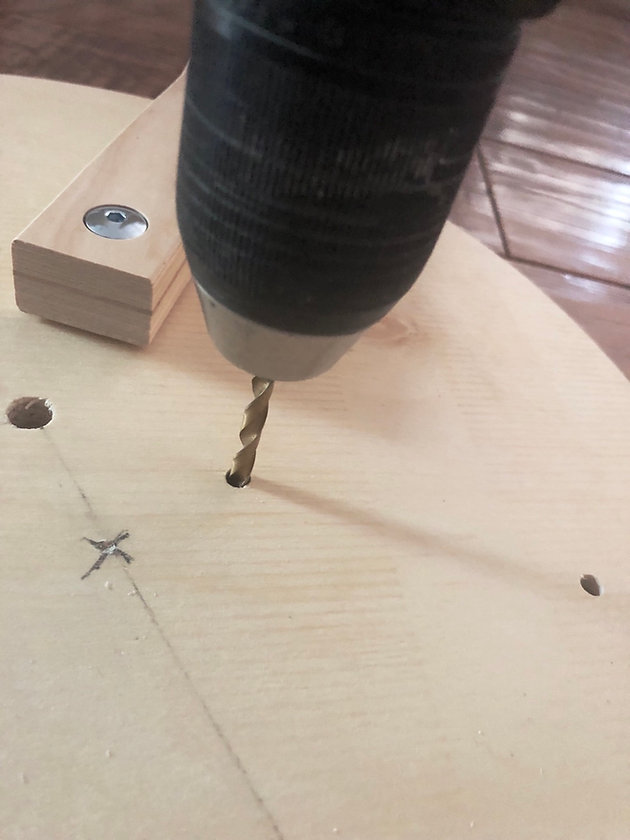
Locate an element on the screen. The width and height of the screenshot is (630, 840). floor on the left side is located at coordinates (84, 54).